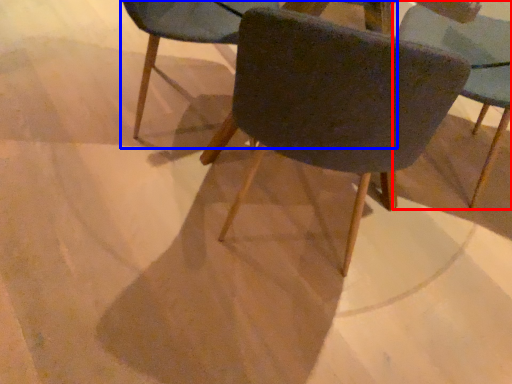
Question: Among these objects, which one is farthest to the camera, chair (highlighted by a red box) or chair (highlighted by a blue box)?

Choices:
 (A) chair
 (B) chair

Answer: (B)